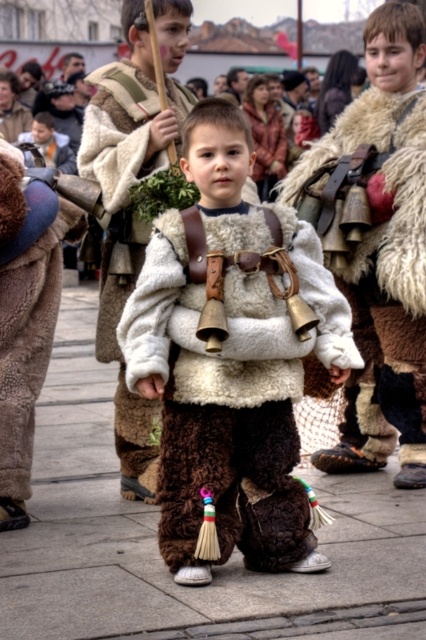
Can you confirm if fuzzy brown pants at center is shorter than brown fur pants at center?

In fact, fuzzy brown pants at center may be taller than brown fur pants at center.

How distant is fuzzy brown pants at center from brown fur pants at center?

fuzzy brown pants at center is 7.90 feet away from brown fur pants at center.

This screenshot has width=426, height=640. What do you see at coordinates (232, 356) in the screenshot? I see `fuzzy brown pants at center` at bounding box center [232, 356].

Identify the location of fuzzy brown pants at center. (232, 356).

Is point (408, 408) more distant than point (129, 435)?

Yes, it is behind point (129, 435).

Can you confirm if fuzzy white vest at center is positioned above fuzzy white fur coat at center?

Incorrect, fuzzy white vest at center is not positioned above fuzzy white fur coat at center.

Is point (423, 100) closer to viewer compared to point (123, 388)?

Yes.

Where is `fuzzy white vest at center`? Image resolution: width=426 pixels, height=640 pixels. fuzzy white vest at center is located at coordinates (376, 266).

Between fuzzy brown pants at center and fuzzy white vest at center, which one is positioned lower?

fuzzy brown pants at center is below.

Consider the image. Can you confirm if fuzzy brown pants at center is smaller than fuzzy white vest at center?

Correct, fuzzy brown pants at center occupies less space than fuzzy white vest at center.

Locate an element on the screen. This screenshot has height=640, width=426. fuzzy brown pants at center is located at coordinates (232, 356).